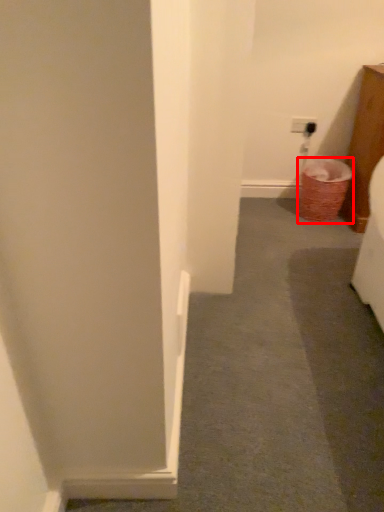
Question: Observing the image, what is the correct spatial positioning of laundry basket (annotated by the red box) in reference to path?

Choices:
 (A) right
 (B) left

Answer: (A)